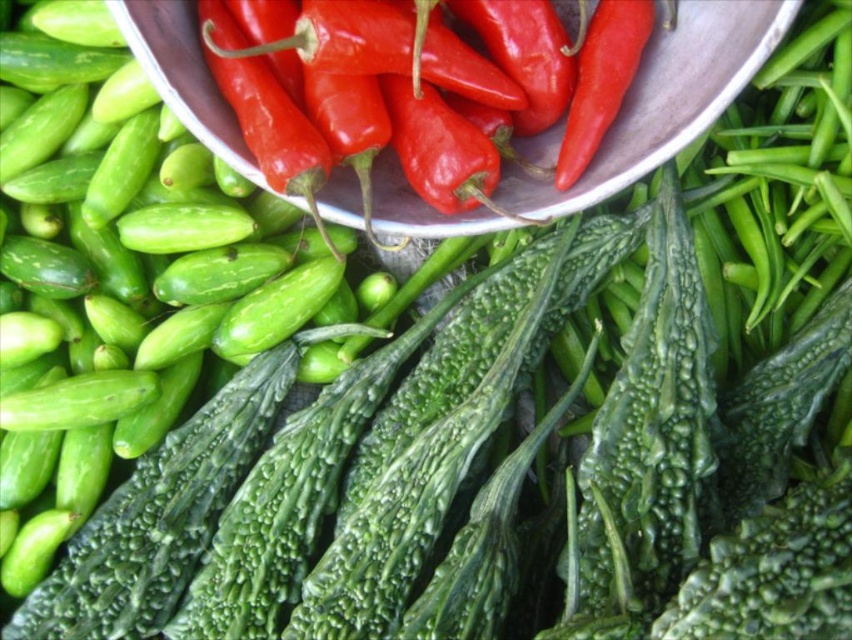
In the scene shown: Can you confirm if green matte cucumber at left is positioned above metallic bowl at upper center?

No.

Is point (239, 236) closer to viewer compared to point (171, 4)?

No, (239, 236) is behind (171, 4).

What do you see at coordinates (131, 307) in the screenshot? I see `green matte cucumber at left` at bounding box center [131, 307].

Where is `green matte cucumber at left`? green matte cucumber at left is located at coordinates (131, 307).